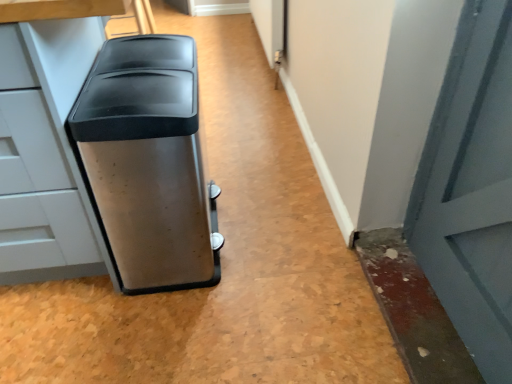
You are a GUI agent. You are given a task and a screenshot of the screen. Output one action in this format:
    pyautogui.click(x=<x>, y=<y>)
    Task: Click on the free space in front of stainless steel trash can at center
    The width and height of the screenshot is (512, 384).
    Given the screenshot: What is the action you would take?
    pyautogui.click(x=160, y=332)